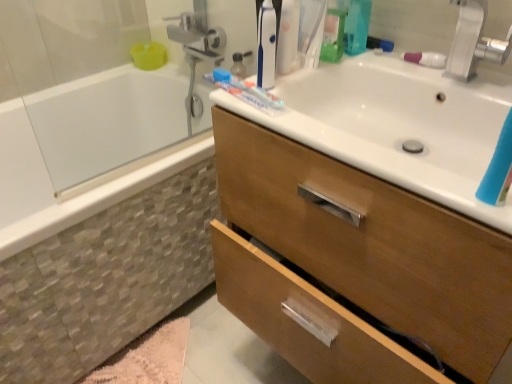
Question: From the image's perspective, is blue plastic toothbrush at upper center under silver metallic faucet at upper right?

Choices:
 (A) yes
 (B) no

Answer: (B)

Question: Is blue plastic toothbrush at upper center with silver metallic faucet at upper right?

Choices:
 (A) no
 (B) yes

Answer: (A)

Question: Does blue plastic toothbrush at upper center have a larger size compared to silver metallic faucet at upper right?

Choices:
 (A) no
 (B) yes

Answer: (A)

Question: Does blue plastic toothbrush at upper center have a greater height compared to silver metallic faucet at upper right?

Choices:
 (A) yes
 (B) no

Answer: (A)

Question: From a real-world perspective, is blue plastic toothbrush at upper center physically below silver metallic faucet at upper right?

Choices:
 (A) no
 (B) yes

Answer: (A)

Question: Is silver metallic faucet at upper right surrounded by blue plastic toothbrush at upper center?

Choices:
 (A) no
 (B) yes

Answer: (A)

Question: Is blue plastic toothbrush at upper center at the right side of white glossy bathtub at left?

Choices:
 (A) no
 (B) yes

Answer: (B)

Question: From the image's perspective, does blue plastic toothbrush at upper center appear higher than white glossy bathtub at left?

Choices:
 (A) yes
 (B) no

Answer: (A)

Question: Considering the relative sizes of blue plastic toothbrush at upper center and white glossy bathtub at left in the image provided, is blue plastic toothbrush at upper center wider than white glossy bathtub at left?

Choices:
 (A) yes
 (B) no

Answer: (B)

Question: Can you confirm if blue plastic toothbrush at upper center is smaller than white glossy bathtub at left?

Choices:
 (A) yes
 (B) no

Answer: (A)

Question: Is blue plastic toothbrush at upper center taller than white glossy bathtub at left?

Choices:
 (A) yes
 (B) no

Answer: (B)

Question: Is blue plastic toothbrush at upper center in contact with white glossy bathtub at left?

Choices:
 (A) no
 (B) yes

Answer: (A)

Question: Is wooden cabinet at upper right at the right side of white glossy bathtub at left?

Choices:
 (A) no
 (B) yes

Answer: (B)